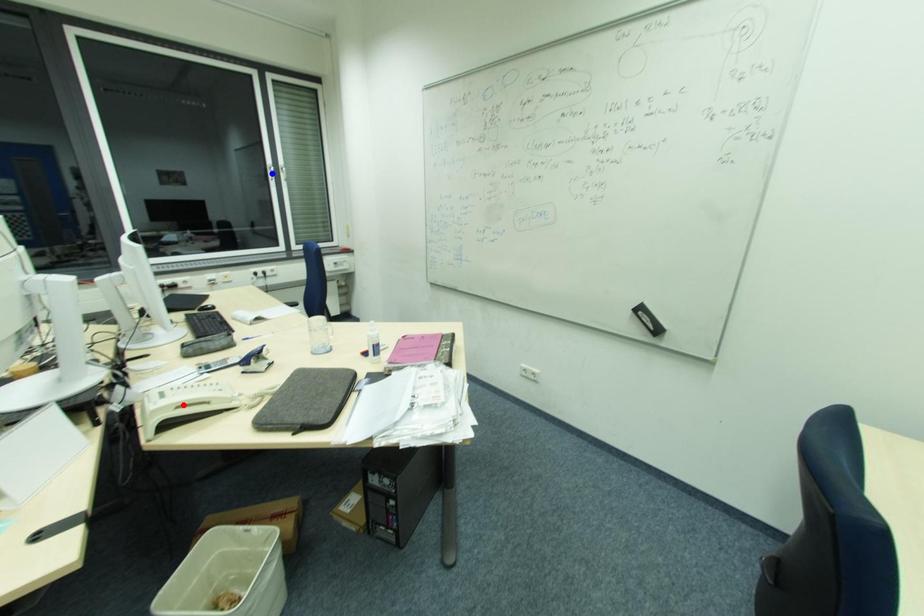
Question: Two points are marked on the image. Which point is closer to the camera?

Choices:
 (A) Blue point is closer.
 (B) Red point is closer.

Answer: (B)